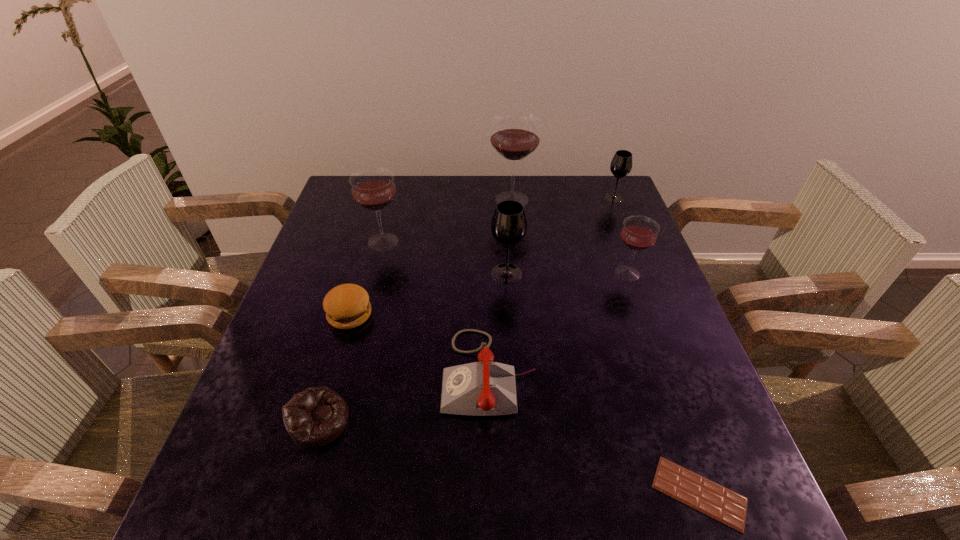
This screenshot has height=540, width=960. Find the location of `free space that is in between the nearest red wineglass and the brown beanbag`. free space that is in between the nearest red wineglass and the brown beanbag is located at coordinates (473, 347).

The image size is (960, 540). What are the coordinates of `free point between the rightmost red wineglass and the brown hamburger` in the screenshot? It's located at [x=489, y=294].

Identify the location of vacant space in between the second nearest red wineglass and the beanbag. Image resolution: width=960 pixels, height=540 pixels. (351, 331).

The width and height of the screenshot is (960, 540). Find the location of `blank region between the biggest red wineglass and the brown chocolate bar`. blank region between the biggest red wineglass and the brown chocolate bar is located at coordinates (606, 346).

I want to click on empty space that is in between the hamburger and the nearer gray wineglass, so click(x=428, y=294).

This screenshot has height=540, width=960. I want to click on free space between the hamburger and the right gray wineglass, so click(x=482, y=256).

Where is `vacant area between the smallest red wineglass and the third farthest wineglass`? This screenshot has width=960, height=540. vacant area between the smallest red wineglass and the third farthest wineglass is located at coordinates pyautogui.click(x=505, y=258).

You are a GUI agent. You are given a task and a screenshot of the screen. Output one action in this format:
    pyautogui.click(x=<x>, y=<y>)
    Task: Click on the vacant point located between the chocolate bar and the left gray wineglass
    
    Given the screenshot: What is the action you would take?
    pyautogui.click(x=603, y=383)

Locate which object is the third closest to the brown chocolate bar. Please provide its 2D coordinates. Your answer should be formatted as a tuple, i.e. [(x, y)], where the tuple contains the x and y coordinates of a point satisfying the conditions above.

[(509, 225)]

Point out which object is positioned as the sixth nearest to the right gray wineglass. Please provide its 2D coordinates. Your answer should be formatted as a tuple, i.e. [(x, y)], where the tuple contains the x and y coordinates of a point satisfying the conditions above.

[(347, 306)]